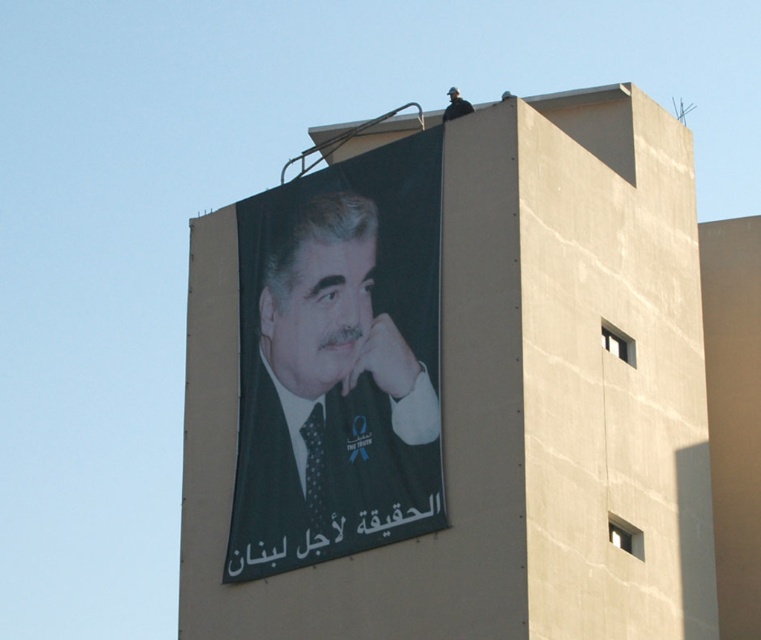
You are an artist trying to paint the scene. You need to decide which object to paint first based on their sizes. Which object should you start with, the dark green matte poster at upper center or the matte black jaw at upper center?

The dark green matte poster at upper center is bigger than the matte black jaw at upper center, so you should start with the dark green matte poster at upper center as it requires more attention due to its larger size.

You are an artist standing in front of the beige building. You need to paint a new poster that is the same height as the matte black jaw at upper center. Based on the scene, how does the height of your new poster compare to the dark green matte poster at upper center?

The dark green matte poster at upper center is much taller than the matte black jaw at upper center. Therefore, your new poster, which is the same height as the matte black jaw at upper center, will be significantly shorter than the dark green matte poster at upper center.